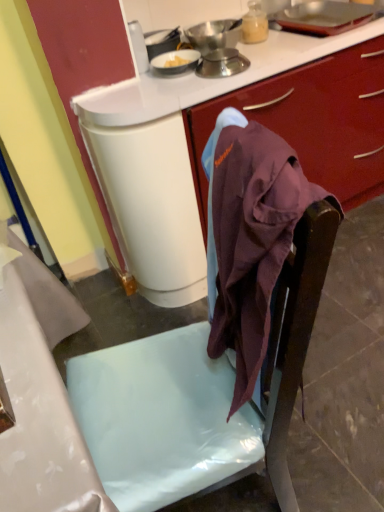
Locate an element on the screen. free location to the right of metallic silver scale at upper center, the first kitchen appliance from the bottom is located at coordinates (273, 57).